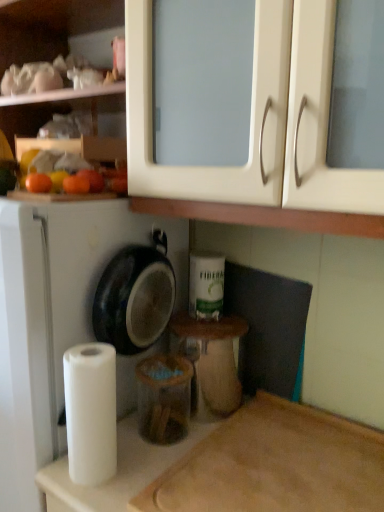
Question: Can you confirm if matte plastic container at center is positioned to the left of white matte paper towel at lower left?

Choices:
 (A) yes
 (B) no

Answer: (B)

Question: Does matte plastic container at center have a smaller size compared to white matte paper towel at lower left?

Choices:
 (A) no
 (B) yes

Answer: (A)

Question: Can you confirm if matte plastic container at center is shorter than white matte paper towel at lower left?

Choices:
 (A) no
 (B) yes

Answer: (B)

Question: Could you tell me if matte plastic container at center is turned towards white matte paper towel at lower left?

Choices:
 (A) yes
 (B) no

Answer: (A)

Question: Is matte plastic container at center closer to camera compared to white matte paper towel at lower left?

Choices:
 (A) no
 (B) yes

Answer: (A)

Question: Does matte plastic container at center have a greater width compared to white matte paper towel at lower left?

Choices:
 (A) yes
 (B) no

Answer: (A)

Question: From the image's perspective, would you say orange matte at left, which ranks as the second orange in left-to-right order, is shown under white matte dish washer at left?

Choices:
 (A) yes
 (B) no

Answer: (B)

Question: Considering the relative positions of orange matte at left, arranged as the first orange when viewed from the right, and white matte dish washer at left in the image provided, is orange matte at left, arranged as the first orange when viewed from the right, to the left of white matte dish washer at left from the viewer's perspective?

Choices:
 (A) yes
 (B) no

Answer: (B)

Question: From a real-world perspective, does orange matte at left, which ranks as the second orange in left-to-right order, stand above white matte dish washer at left?

Choices:
 (A) no
 (B) yes

Answer: (B)

Question: Can you confirm if orange matte at left, arranged as the first orange when viewed from the right, is thinner than white matte dish washer at left?

Choices:
 (A) yes
 (B) no

Answer: (A)

Question: Can you confirm if orange matte at left, arranged as the first orange when viewed from the right, is shorter than white matte dish washer at left?

Choices:
 (A) yes
 (B) no

Answer: (A)

Question: Considering the relative sizes of orange matte at left, arranged as the first orange when viewed from the right, and white matte dish washer at left in the image provided, is orange matte at left, arranged as the first orange when viewed from the right, wider than white matte dish washer at left?

Choices:
 (A) no
 (B) yes

Answer: (A)

Question: Does white matte paper towel at lower left have a lesser height compared to white matte dish washer at left?

Choices:
 (A) yes
 (B) no

Answer: (A)